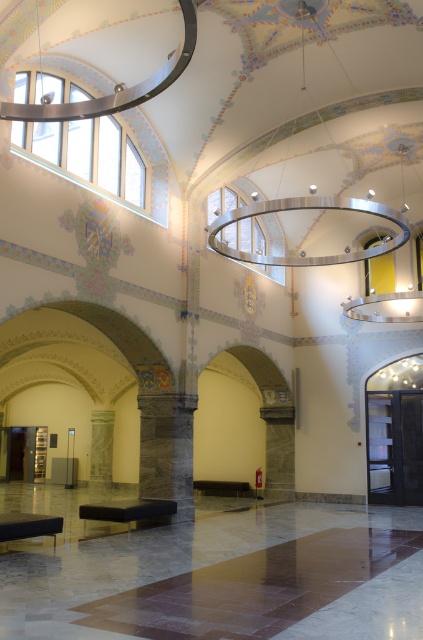
Does matte black door at right appear on the right side of marble pillar at center?

Yes, matte black door at right is to the right of marble pillar at center.

Is matte black door at right smaller than marble pillar at center?

No.

Image resolution: width=423 pixels, height=640 pixels. Identify the location of matte black door at right. (395, 433).